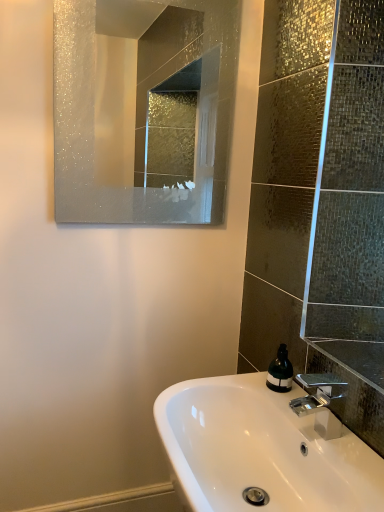
Question: Considering the positions of point (110, 161) and point (316, 406), is point (110, 161) closer or farther from the camera than point (316, 406)?

Choices:
 (A) closer
 (B) farther

Answer: (B)

Question: Considering their positions, is frosted glass mirror at upper center located in front of or behind polished chrome faucet at lower right?

Choices:
 (A) behind
 (B) front

Answer: (A)

Question: Estimate the real-world distances between objects in this image. Which object is closer to the green matte soap dispenser at lower right?

Choices:
 (A) polished chrome faucet at lower right
 (B) white glossy sink at lower center
 (C) frosted glass mirror at upper center

Answer: (A)

Question: Which object is the closest to the white glossy sink at lower center?

Choices:
 (A) frosted glass mirror at upper center
 (B) green matte soap dispenser at lower right
 (C) polished chrome faucet at lower right

Answer: (C)